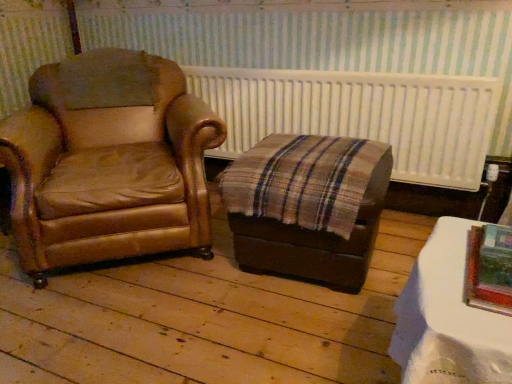
Identify the location of free area behind white glossy table at lower right. The image size is (512, 384). (342, 327).